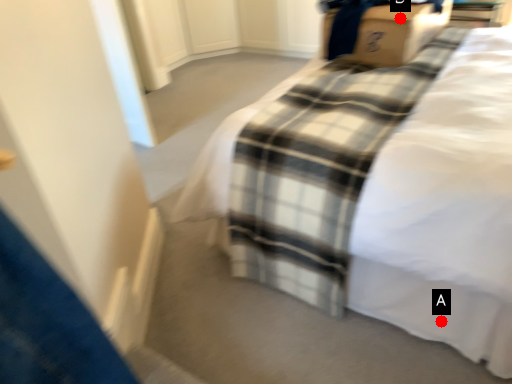
Question: Two points are circled on the image, labeled by A and B beside each circle. Which point is farther to the camera?

Choices:
 (A) A is further
 (B) B is further

Answer: (B)